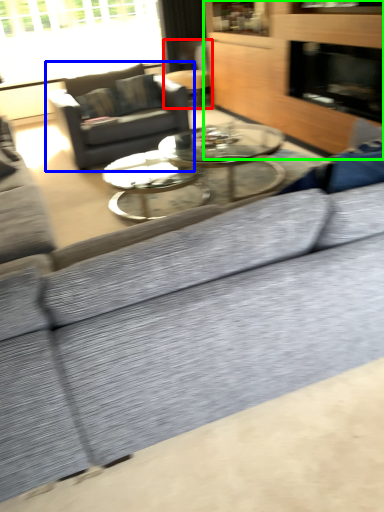
Question: Which is nearer to the swivel chair (highlighted by a red box)? studio couch (highlighted by a blue box) or dresser (highlighted by a green box).

Choices:
 (A) studio couch
 (B) dresser

Answer: (B)